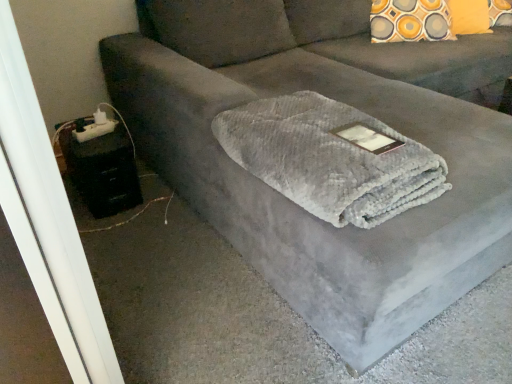
Image resolution: width=512 pixels, height=384 pixels. Describe the element at coordinates (101, 168) in the screenshot. I see `black plastic table at lower left` at that location.

The image size is (512, 384). Identify the location of black plastic table at lower left. (101, 168).

This screenshot has width=512, height=384. Describe the element at coordinates (331, 158) in the screenshot. I see `gray plush blanket at center` at that location.

In order to click on gray plush blanket at center in this screenshot , I will do `click(331, 158)`.

Where is `black plastic table at lower left`? The height and width of the screenshot is (384, 512). black plastic table at lower left is located at coordinates (101, 168).

Considering the relative positions of gray plush blanket at center and black plastic table at lower left in the image provided, is gray plush blanket at center to the left of black plastic table at lower left from the viewer's perspective?

Incorrect, gray plush blanket at center is not on the left side of black plastic table at lower left.

Which object is closer to the camera, gray plush blanket at center or black plastic table at lower left?

gray plush blanket at center is closer to the camera.

Is point (387, 157) closer to camera compared to point (85, 194)?

Yes.

From the image's perspective, is gray plush blanket at center under black plastic table at lower left?

Incorrect, from the image's perspective, gray plush blanket at center is higher than black plastic table at lower left.

Based on the photo, from a real-world perspective, which is physically above, gray plush blanket at center or black plastic table at lower left?

gray plush blanket at center is physically above.

From the picture: Which of these two, gray plush blanket at center or black plastic table at lower left, is wider?

gray plush blanket at center is wider.

Does gray plush blanket at center have a greater height compared to black plastic table at lower left?

No.

Who is smaller, gray plush blanket at center or black plastic table at lower left?

With smaller size is black plastic table at lower left.

Consider the image. Does gray plush blanket at center contain black plastic table at lower left?

No, gray plush blanket at center does not contain black plastic table at lower left.

Is gray plush blanket at center with black plastic table at lower left?

No.

Could you tell me if gray plush blanket at center is turned towards black plastic table at lower left?

No, gray plush blanket at center is not facing towards black plastic table at lower left.

In order to click on bath towel above the black plastic table at lower left (from the image's perspective) in this screenshot , I will do `click(331, 158)`.

Considering the relative positions of black plastic table at lower left and gray plush blanket at center in the image provided, is black plastic table at lower left to the right of gray plush blanket at center from the viewer's perspective?

No.

Which object is closer to the camera taking this photo, black plastic table at lower left or gray plush blanket at center?

gray plush blanket at center is more forward.

Which is closer to the camera, (104, 204) or (332, 178)?

Point (104, 204) is farther from the camera than point (332, 178).

From the image's perspective, between black plastic table at lower left and gray plush blanket at center, which one is located above?

From the image's view, gray plush blanket at center is above.

From a real-world perspective, is black plastic table at lower left located beneath gray plush blanket at center?

Yes, from a real-world perspective, black plastic table at lower left is beneath gray plush blanket at center.

Which object is wider, black plastic table at lower left or gray plush blanket at center?

With larger width is gray plush blanket at center.

Is black plastic table at lower left taller than gray plush blanket at center?

Correct, black plastic table at lower left is much taller as gray plush blanket at center.

Considering the sizes of objects black plastic table at lower left and gray plush blanket at center in the image provided, who is bigger, black plastic table at lower left or gray plush blanket at center?

gray plush blanket at center.

Is black plastic table at lower left spatially inside gray plush blanket at center, or outside of it?

black plastic table at lower left is located beyond the bounds of gray plush blanket at center.

Consider the image. Would you say black plastic table at lower left is a long distance from gray plush blanket at center?

No, black plastic table at lower left is not far from gray plush blanket at center.

Looking at this image, is black plastic table at lower left looking in the opposite direction of gray plush blanket at center?

No, black plastic table at lower left's orientation is not away from gray plush blanket at center.

Locate an element on the screen. Image resolution: width=512 pixels, height=384 pixels. table lying behind the gray plush blanket at center is located at coordinates tap(101, 168).

Where is `bath towel that is above the black plastic table at lower left (from a real-world perspective)`? The image size is (512, 384). bath towel that is above the black plastic table at lower left (from a real-world perspective) is located at coordinates (331, 158).

The width and height of the screenshot is (512, 384). In order to click on bath towel that is in front of the black plastic table at lower left in this screenshot , I will do `click(331, 158)`.